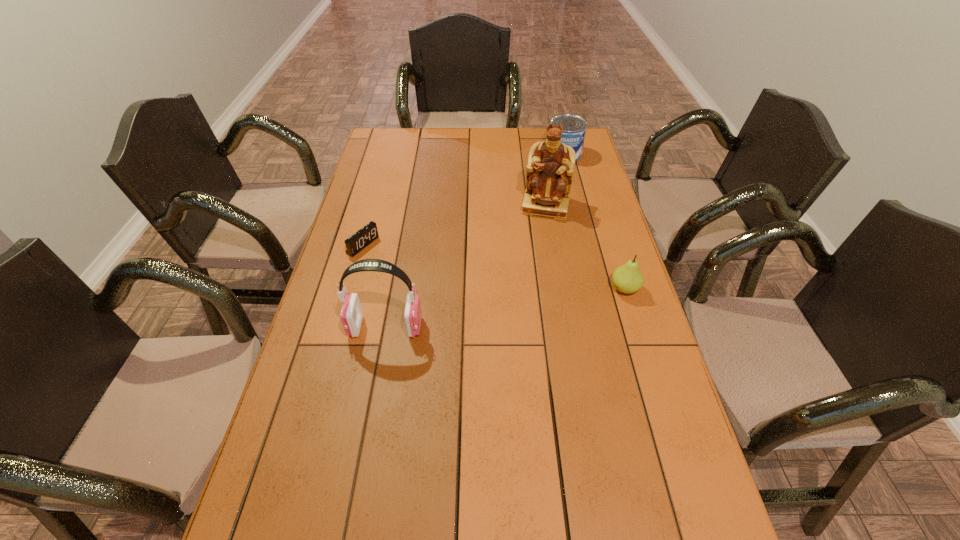
In order to click on the nearest object in this screenshot , I will do `click(351, 315)`.

The width and height of the screenshot is (960, 540). In order to click on earphone in this screenshot , I will do `click(351, 315)`.

This screenshot has height=540, width=960. I want to click on pear, so click(627, 278).

You are a GUI agent. You are given a task and a screenshot of the screen. Output one action in this format:
    pyautogui.click(x=<x>, y=<y>)
    Task: Click on the third farthest object
    
    Given the screenshot: What is the action you would take?
    pyautogui.click(x=362, y=238)

The width and height of the screenshot is (960, 540). Find the location of `alarm clock`. alarm clock is located at coordinates [x=362, y=238].

The image size is (960, 540). I want to click on figurine, so click(550, 166).

Find the location of a particular element. The image size is (960, 540). the tallest object is located at coordinates (550, 166).

Where is `the farthest object`? The image size is (960, 540). the farthest object is located at coordinates (574, 127).

Find the location of `vacant region located on the outer surface of the earphone`. vacant region located on the outer surface of the earphone is located at coordinates (321, 327).

Identify the location of blank space located on the outer surface of the earphone. This screenshot has width=960, height=540. (324, 327).